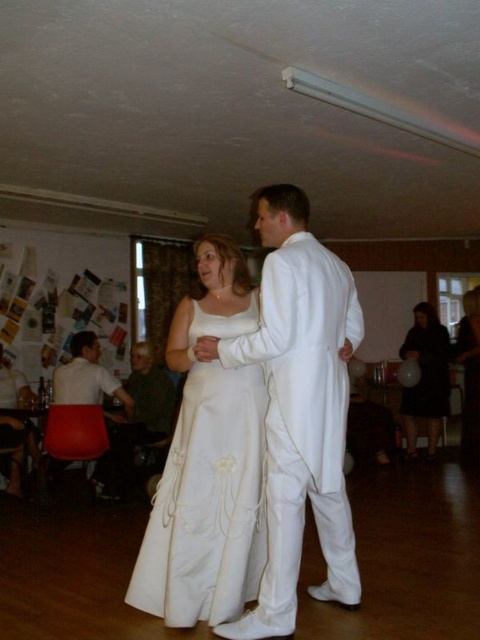
Question: Can you confirm if satin white dress at center is thinner than black satin dress at lower right?

Choices:
 (A) yes
 (B) no

Answer: (B)

Question: Which object is positioned farthest from the satin white suit at center?

Choices:
 (A) satin white dress at center
 (B) white satin robe at center
 (C) black satin dress at lower right
 (D) matte white chair at lower left

Answer: (C)

Question: Is matte white chair at lower left wider than white satin robe at center?

Choices:
 (A) yes
 (B) no

Answer: (A)

Question: Which point is farther to the camera?

Choices:
 (A) (264, 234)
 (B) (468, 296)

Answer: (B)

Question: Can you confirm if satin white suit at center is positioned to the left of white satin robe at center?

Choices:
 (A) yes
 (B) no

Answer: (A)

Question: Which point is farther to the camera?

Choices:
 (A) matte white chair at lower left
 (B) black satin dress at lower right
 (C) satin white dress at center

Answer: (B)